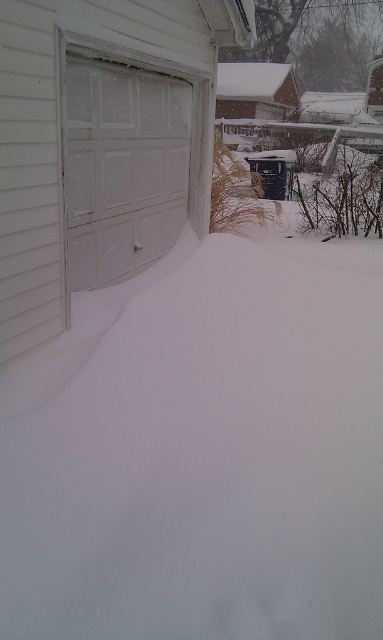
How distant is white matte garage door at left from white frosted garage door at left?

A distance of 4.89 inches exists between white matte garage door at left and white frosted garage door at left.

Between white matte garage door at left and white frosted garage door at left, which one is positioned lower?

white matte garage door at left is below.

Does point (232, 42) come in front of point (93, 61)?

That is False.

The width and height of the screenshot is (383, 640). What are the coordinates of `white matte garage door at left` in the screenshot? It's located at (101, 145).